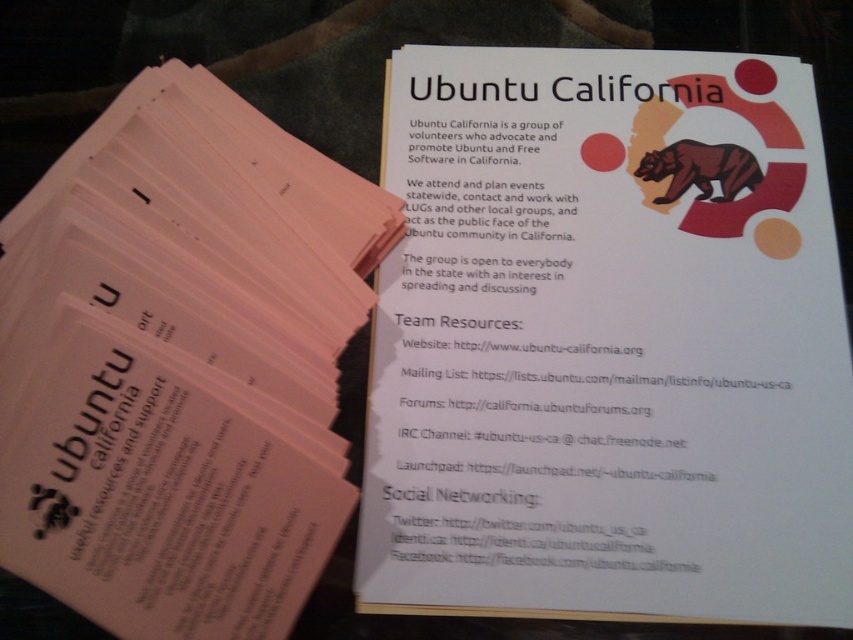
Question: Which point is farther from the camera taking this photo?

Choices:
 (A) (524, 410)
 (B) (242, 508)

Answer: (A)

Question: Does white paper at upper center lie behind pink paper flyer at upper left?

Choices:
 (A) no
 (B) yes

Answer: (B)

Question: Which of the following is the closest to the observer?

Choices:
 (A) (294, 344)
 (B) (375, 314)

Answer: (A)

Question: Can you confirm if white paper at upper center is positioned above pink paper flyer at upper left?

Choices:
 (A) no
 (B) yes

Answer: (B)

Question: Is white paper at upper center positioned before pink paper flyer at upper left?

Choices:
 (A) no
 (B) yes

Answer: (A)